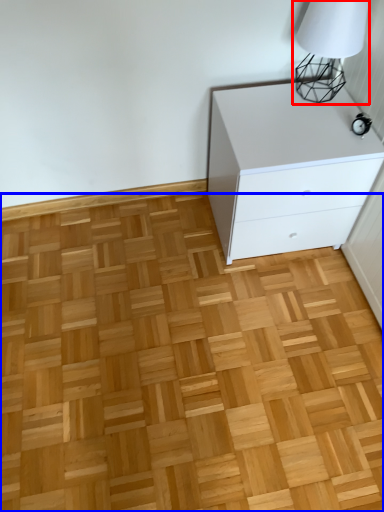
Question: Among these objects, which one is nearest to the camera, table lamp (highlighted by a red box) or hardwood (highlighted by a blue box)?

Choices:
 (A) table lamp
 (B) hardwood

Answer: (B)